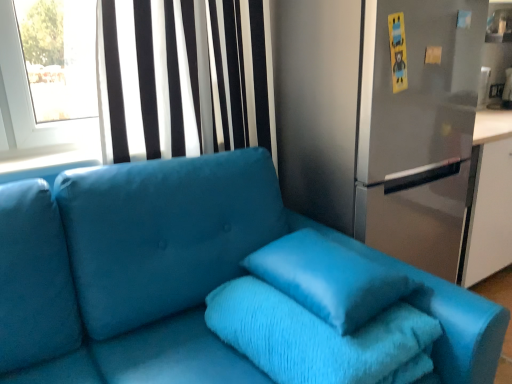
Question: Does turquoise plush bath towel at center have a greater width compared to satin black curtain at upper left?

Choices:
 (A) no
 (B) yes

Answer: (B)

Question: Could you tell me if turquoise plush bath towel at center is facing satin black curtain at upper left?

Choices:
 (A) yes
 (B) no

Answer: (B)

Question: Is turquoise plush bath towel at center further to the viewer compared to satin black curtain at upper left?

Choices:
 (A) no
 (B) yes

Answer: (A)

Question: Is turquoise plush bath towel at center touching satin black curtain at upper left?

Choices:
 (A) no
 (B) yes

Answer: (A)

Question: Is turquoise plush bath towel at center to the left of satin black curtain at upper left from the viewer's perspective?

Choices:
 (A) no
 (B) yes

Answer: (A)

Question: Considering the relative positions of satin blue pillow at center and turquoise plush bath towel at center in the image provided, is satin blue pillow at center to the left or to the right of turquoise plush bath towel at center?

Choices:
 (A) left
 (B) right

Answer: (B)

Question: Considering the positions of satin blue pillow at center and turquoise plush bath towel at center in the image, is satin blue pillow at center taller or shorter than turquoise plush bath towel at center?

Choices:
 (A) tall
 (B) short

Answer: (A)

Question: From a real-world perspective, is satin blue pillow at center above or below turquoise plush bath towel at center?

Choices:
 (A) above
 (B) below

Answer: (A)

Question: In terms of width, does satin blue pillow at center look wider or thinner when compared to turquoise plush bath towel at center?

Choices:
 (A) thin
 (B) wide

Answer: (A)

Question: From the image's perspective, is satin black curtain at upper left positioned above or below satin blue couch at center?

Choices:
 (A) below
 (B) above

Answer: (B)

Question: From a real-world perspective, is satin black curtain at upper left above or below satin blue couch at center?

Choices:
 (A) above
 (B) below

Answer: (A)

Question: Is satin black curtain at upper left to the left or to the right of satin blue couch at center in the image?

Choices:
 (A) left
 (B) right

Answer: (A)

Question: Considering the positions of satin black curtain at upper left and satin blue couch at center in the image, is satin black curtain at upper left bigger or smaller than satin blue couch at center?

Choices:
 (A) big
 (B) small

Answer: (B)

Question: Considering the positions of point (419, 137) and point (198, 3), is point (419, 137) closer or farther from the camera than point (198, 3)?

Choices:
 (A) farther
 (B) closer

Answer: (B)

Question: In terms of height, does satin silver fridge at center look taller or shorter compared to satin black curtain at upper left?

Choices:
 (A) short
 (B) tall

Answer: (B)